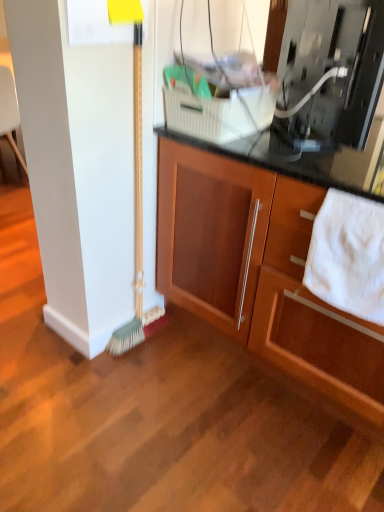
This screenshot has width=384, height=512. Find the location of `vacant location below green bristle broom at left (from a real-world perspective)`. vacant location below green bristle broom at left (from a real-world perspective) is located at coordinates (139, 339).